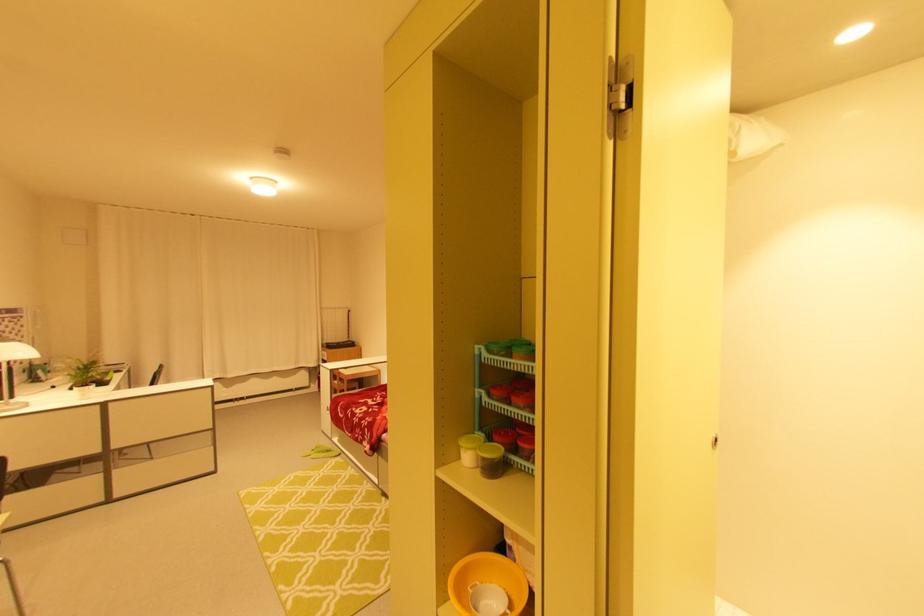
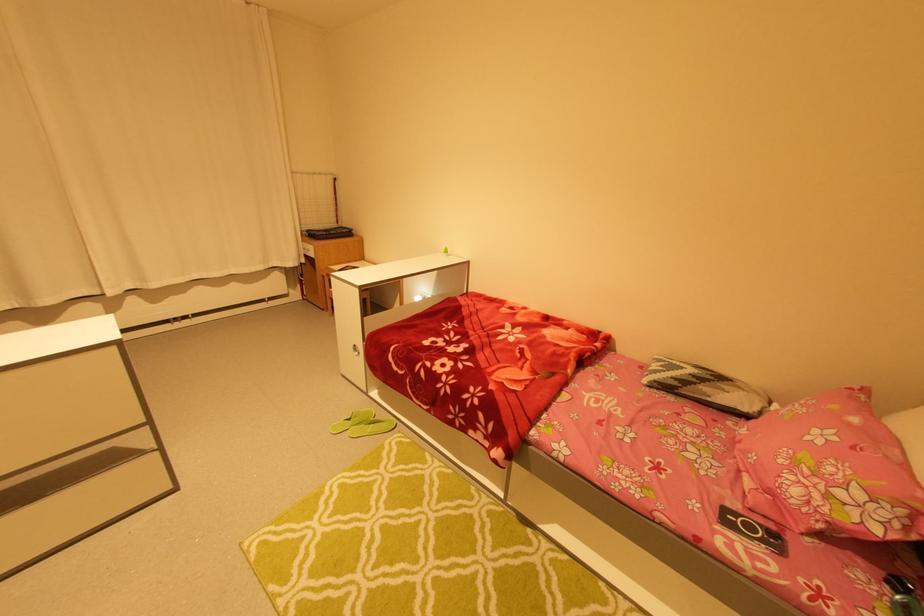
In the second image, find the point that corresponds to [319,450] in the first image.

(354, 419)